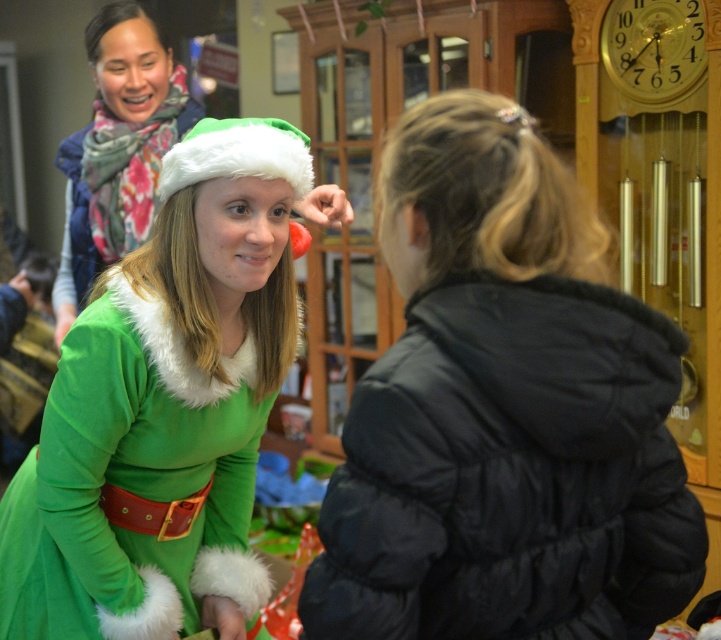
Is point (118, 195) farther from viewer compared to point (288, 131)?

Yes, it is.

Which is above, matte green fur-trimmed dress at center or white fluffy santa hat at center?

Positioned higher is matte green fur-trimmed dress at center.

The image size is (721, 640). Identify the location of matte green fur-trimmed dress at center. (118, 148).

Find the location of `matte green fur-trimmed dress at center`. matte green fur-trimmed dress at center is located at coordinates (118, 148).

Can you confirm if black puffy coat at right is positioned to the right of matte green fur-trimmed dress at center?

Indeed, black puffy coat at right is positioned on the right side of matte green fur-trimmed dress at center.

In order to click on black puffy coat at right in this screenshot , I will do `click(504, 412)`.

This screenshot has width=721, height=640. I want to click on black puffy coat at right, so click(x=504, y=412).

Does black puffy coat at right have a greater height compared to white fluffy santa hat at center?

Indeed, black puffy coat at right has a greater height compared to white fluffy santa hat at center.

Between black puffy coat at right and white fluffy santa hat at center, which one appears on the right side from the viewer's perspective?

Positioned to the right is black puffy coat at right.

The height and width of the screenshot is (640, 721). What do you see at coordinates (504, 412) in the screenshot?
I see `black puffy coat at right` at bounding box center [504, 412].

Find the location of `black puffy coat at right`. black puffy coat at right is located at coordinates (504, 412).